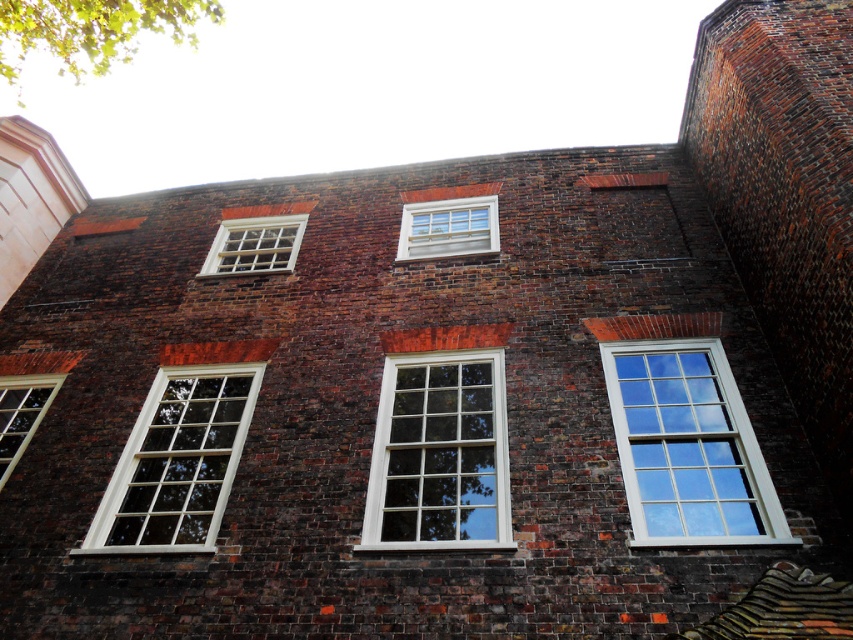
Question: Is white wood window at right further to camera compared to white wooden window at upper center?

Choices:
 (A) yes
 (B) no

Answer: (B)

Question: Is white wooden window at upper center behind matte white window at lower left?

Choices:
 (A) yes
 (B) no

Answer: (A)

Question: Which of the following is the closest to the observer?

Choices:
 (A) white wood window at center
 (B) white wooden window at upper center

Answer: (A)

Question: Which is farther from the white wood window at center?

Choices:
 (A) white wooden window at upper center
 (B) white wood window at right
 (C) matte white window at lower left
 (D) white wood window at lower left

Answer: (C)

Question: Is white wood window at right wider than white wooden window at center?

Choices:
 (A) no
 (B) yes

Answer: (A)

Question: Which point is closer to the camera taking this photo?

Choices:
 (A) (175, 369)
 (B) (9, 424)
 (C) (437, 209)
 (D) (701, 346)

Answer: (D)